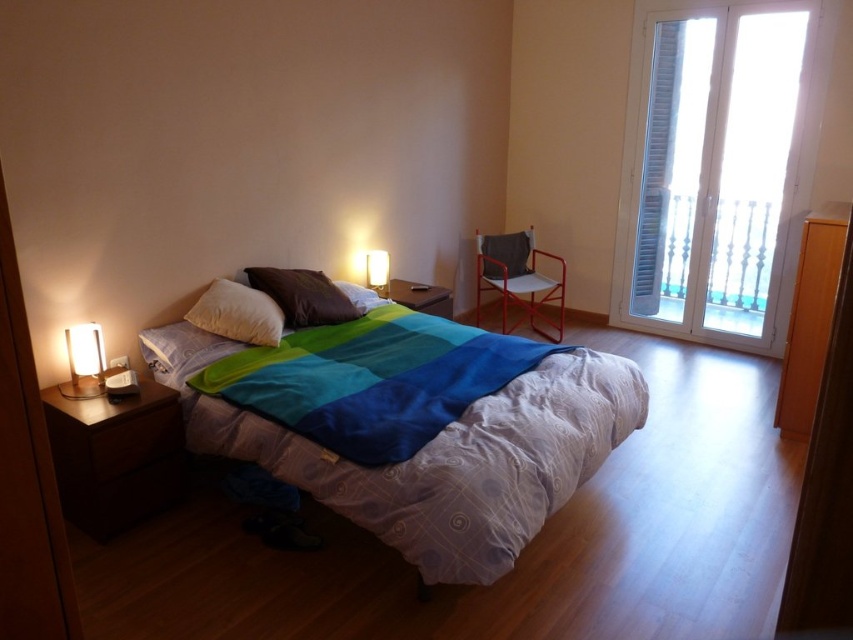
Question: Which point appears farthest from the camera in this image?

Choices:
 (A) (486, 536)
 (B) (68, 353)
 (C) (529, 243)
 (D) (688, 129)

Answer: (C)

Question: Can you confirm if multicolored fabric blanket at center is bigger than matte white lamp at left?

Choices:
 (A) no
 (B) yes

Answer: (B)

Question: Is matte white lamp at left positioned before matte gold lamp at upper center?

Choices:
 (A) yes
 (B) no

Answer: (A)

Question: Does brown matte pillow at center appear over matte white lamp at left?

Choices:
 (A) no
 (B) yes

Answer: (B)

Question: Which of the following is the closest to the observer?

Choices:
 (A) multicolored fabric blanket at center
 (B) matte white lamp at left
 (C) matte gold lamp at upper center

Answer: (A)

Question: Based on their relative distances, which object is farther from the metallic red chair at center?

Choices:
 (A) matte gold lamp at upper center
 (B) brown matte pillow at center

Answer: (B)